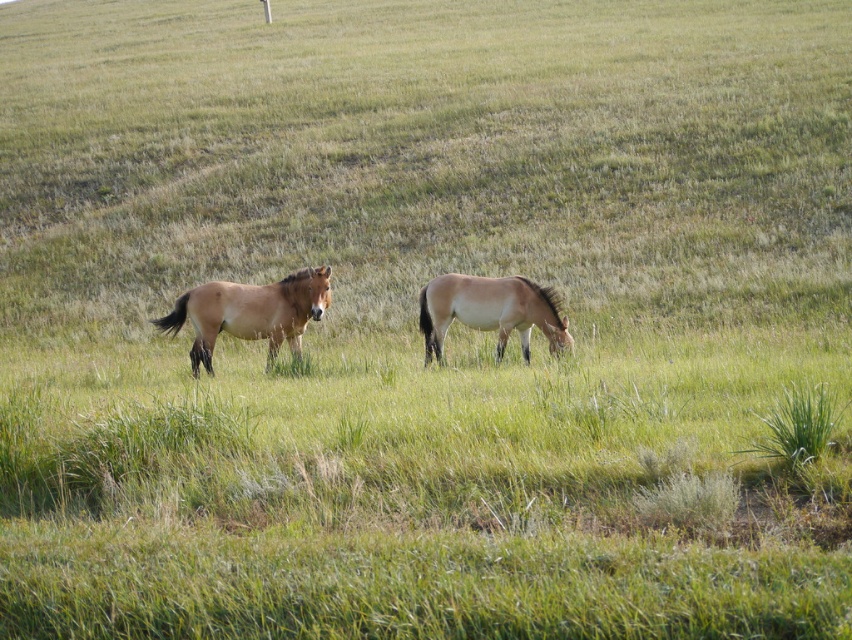
Is brown matte horse at center above light brown glossy horse at center?

Incorrect, brown matte horse at center is not positioned above light brown glossy horse at center.

Can you confirm if brown matte horse at center is shorter than light brown glossy horse at center?

No.

Between point (303, 305) and point (481, 291), which one is positioned behind?

Point (481, 291)

This screenshot has height=640, width=852. I want to click on brown matte horse at center, so point(250,312).